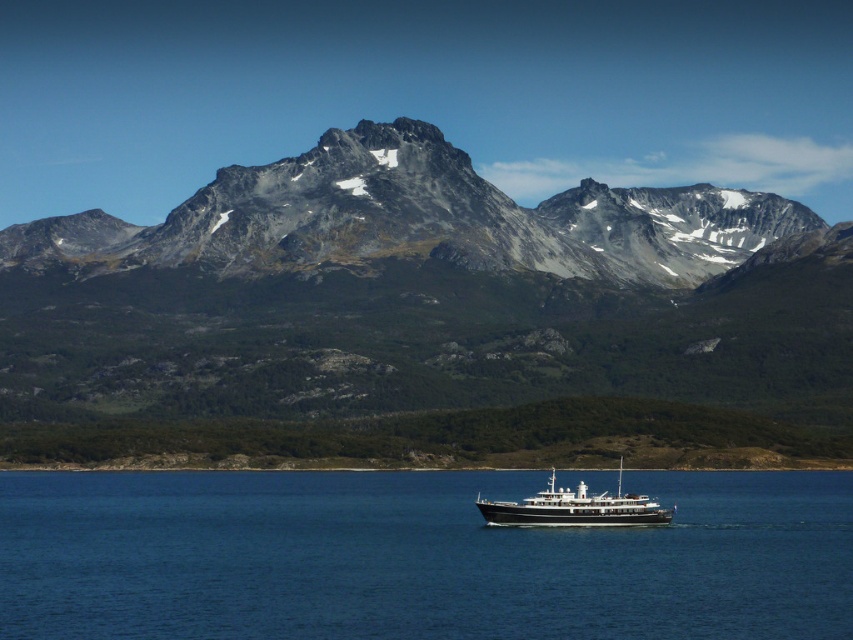
Question: Which object appears farthest from the camera in this image?

Choices:
 (A) blue water at center
 (B) black polished wood boat at center

Answer: (B)

Question: Does gray rocky mountain range at center appear over black polished wood boat at center?

Choices:
 (A) yes
 (B) no

Answer: (A)

Question: Is gray rocky mountain range at center to the left of black polished wood boat at center from the viewer's perspective?

Choices:
 (A) yes
 (B) no

Answer: (A)

Question: Can you confirm if blue water at center is wider than black polished wood boat at center?

Choices:
 (A) no
 (B) yes

Answer: (B)

Question: Which of these objects is positioned farthest from the gray rocky mountain range at center?

Choices:
 (A) black polished wood boat at center
 (B) blue water at center

Answer: (A)

Question: Estimate the real-world distances between objects in this image. Which object is farther from the blue water at center?

Choices:
 (A) gray rocky mountain range at center
 (B) black polished wood boat at center

Answer: (A)